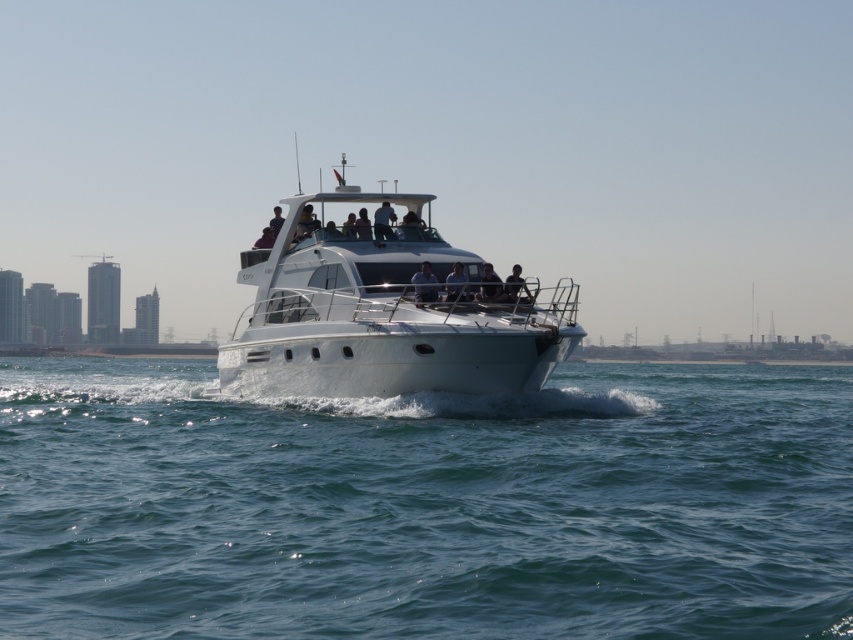
Between clear blue water at center and smooth black shirt at center, which one appears on the left side from the viewer's perspective?

Positioned to the left is clear blue water at center.

Does clear blue water at center appear on the left side of smooth black shirt at center?

Correct, you'll find clear blue water at center to the left of smooth black shirt at center.

Does point (563, 598) lie in front of point (502, 284)?

Yes, point (563, 598) is closer to viewer.

Locate an element on the screen. clear blue water at center is located at coordinates (426, 506).

Looking at this image, is dark blue fabric jacket at center positioned in front of smooth black shirt at center?

No, it is not.

What do you see at coordinates (515, 288) in the screenshot?
I see `dark blue fabric jacket at center` at bounding box center [515, 288].

I want to click on dark blue fabric jacket at center, so click(x=515, y=288).

Measure the distance from clear blue water at center to matte blue shirt at center.

A distance of 63.05 feet exists between clear blue water at center and matte blue shirt at center.

Which is more to the right, clear blue water at center or matte blue shirt at center?

clear blue water at center is more to the right.

Image resolution: width=853 pixels, height=640 pixels. Describe the element at coordinates (426, 506) in the screenshot. I see `clear blue water at center` at that location.

What are the coordinates of `clear blue water at center` in the screenshot? It's located at (426, 506).